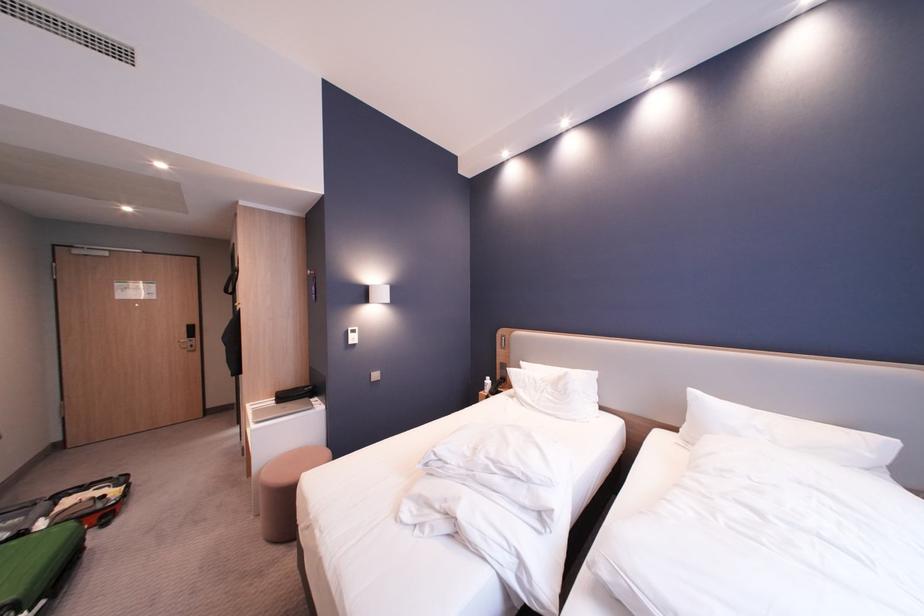
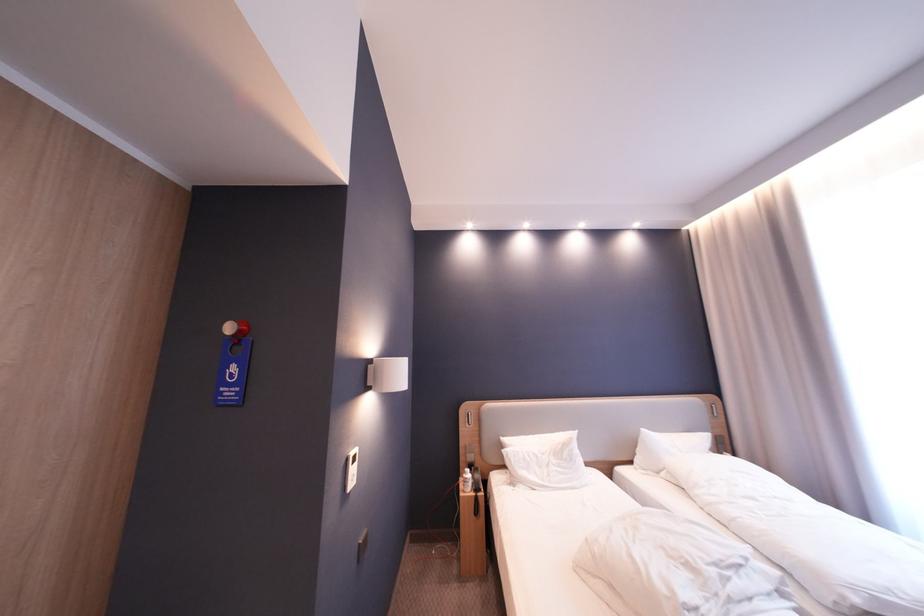
Find the pixel in the second image that matches the point at 549,382 in the first image.

(550, 456)